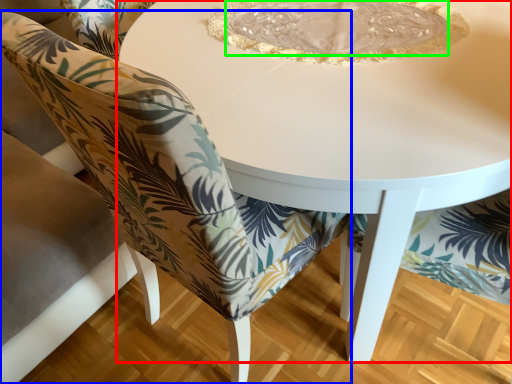
Question: Which is farther away from table (highlighted by a red box)? chair (highlighted by a blue box) or glass plate (highlighted by a green box)?

Choices:
 (A) chair
 (B) glass plate

Answer: (A)